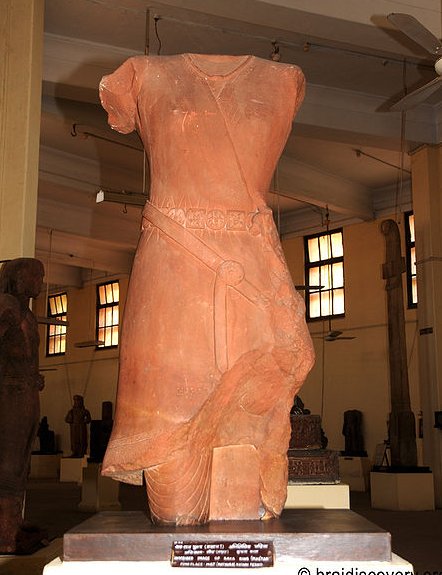
Find the location of `ceiling`. ceiling is located at coordinates point(350,16).